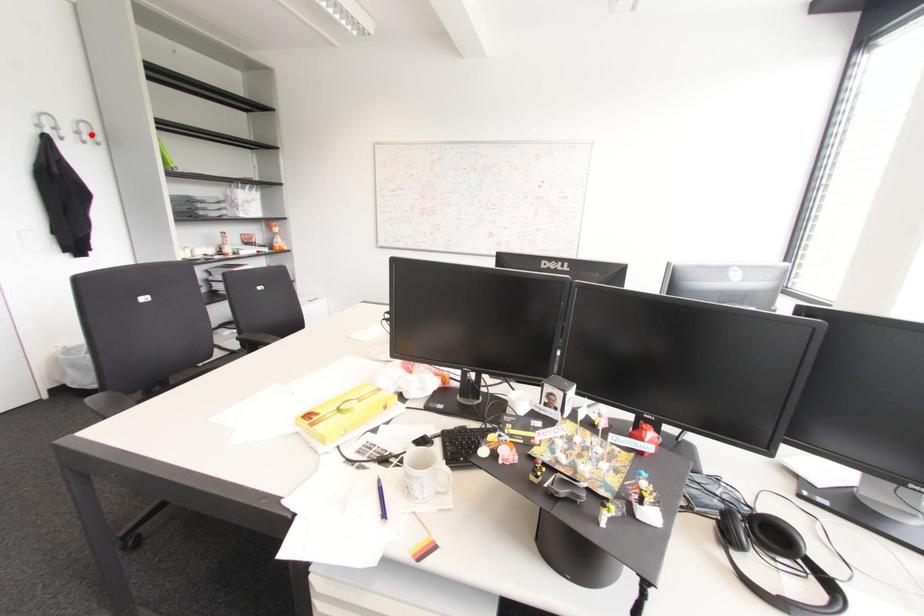
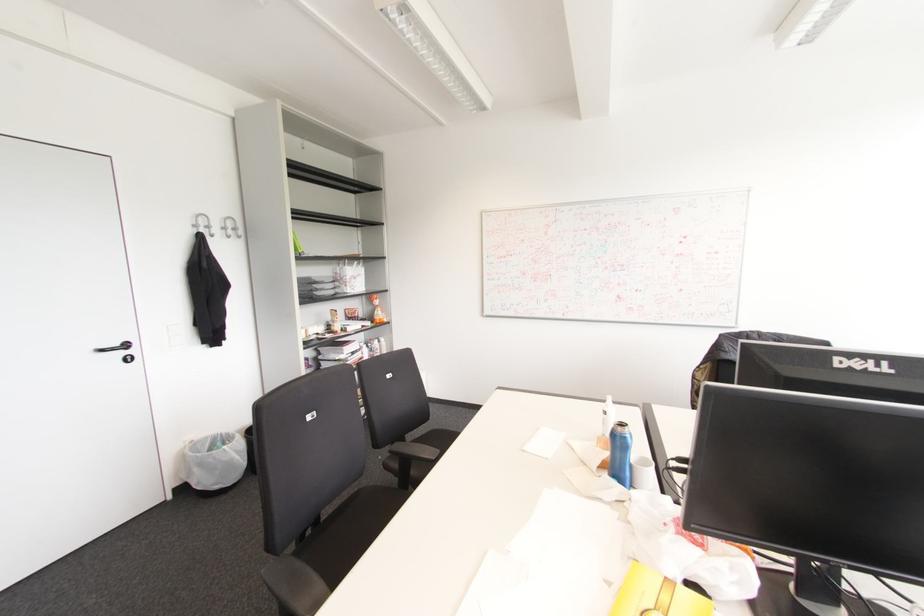
In the second image, find the point that corresponds to the highlighted location in the first image.

(234, 229)